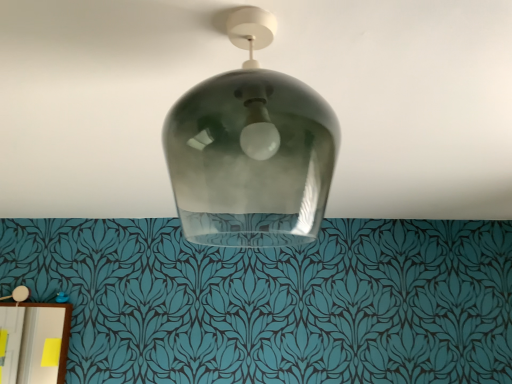
Question: Is matte white lampshade at lower left, the 1th lamp in the left-to-right sequence, beside smoke glass lampshade at center, the first lamp viewed from the front?

Choices:
 (A) no
 (B) yes

Answer: (A)

Question: Is matte white lampshade at lower left, the first lamp in the bottom-to-top sequence, smaller than smoke glass lampshade at center, the first lamp viewed from the front?

Choices:
 (A) no
 (B) yes

Answer: (B)

Question: From the image's perspective, is matte white lampshade at lower left, which is counted as the 2th lamp, starting from the front, under smoke glass lampshade at center, the first lamp viewed from the front?

Choices:
 (A) no
 (B) yes

Answer: (B)

Question: Is matte white lampshade at lower left, the 1th lamp in the left-to-right sequence, oriented towards smoke glass lampshade at center, marked as the second lamp in a left-to-right arrangement?

Choices:
 (A) yes
 (B) no

Answer: (B)

Question: Considering the relative positions of matte white lampshade at lower left, marked as the second lamp in a top-to-bottom arrangement, and smoke glass lampshade at center, placed as the 1th lamp when sorted from right to left, in the image provided, is matte white lampshade at lower left, marked as the second lamp in a top-to-bottom arrangement, to the left of smoke glass lampshade at center, placed as the 1th lamp when sorted from right to left, from the viewer's perspective?

Choices:
 (A) yes
 (B) no

Answer: (A)

Question: From the image's perspective, is matte white lampshade at lower left, which is counted as the 2th lamp, starting from the right, above or below smoke glass lampshade at center, which is counted as the second lamp, starting from the bottom?

Choices:
 (A) above
 (B) below

Answer: (B)

Question: Is matte white lampshade at lower left, the 1th lamp in the left-to-right sequence, inside the boundaries of smoke glass lampshade at center, acting as the first lamp starting from the top, or outside?

Choices:
 (A) inside
 (B) outside

Answer: (B)

Question: Considering the positions of matte white lampshade at lower left, marked as the second lamp in a top-to-bottom arrangement, and smoke glass lampshade at center, the first lamp viewed from the front, in the image, is matte white lampshade at lower left, marked as the second lamp in a top-to-bottom arrangement, bigger or smaller than smoke glass lampshade at center, the first lamp viewed from the front,?

Choices:
 (A) small
 (B) big

Answer: (A)

Question: Considering the positions of point click(29, 294) and point click(215, 195), is point click(29, 294) closer or farther from the camera than point click(215, 195)?

Choices:
 (A) farther
 (B) closer

Answer: (A)

Question: Is point (328, 148) closer or farther from the camera than point (10, 296)?

Choices:
 (A) closer
 (B) farther

Answer: (A)

Question: Which is correct: smoke glass lampshade at center, marked as the second lamp in a left-to-right arrangement, is inside matte white lampshade at lower left, which is counted as the 2th lamp, starting from the front, or outside of it?

Choices:
 (A) outside
 (B) inside

Answer: (A)

Question: Looking at the image, does smoke glass lampshade at center, which ranks as the 2th lamp in back-to-front order, seem bigger or smaller compared to matte white lampshade at lower left, which is counted as the 2th lamp, starting from the right?

Choices:
 (A) small
 (B) big

Answer: (B)

Question: From the image's perspective, is smoke glass lampshade at center, the first lamp viewed from the front, positioned above or below matte white lampshade at lower left, which is counted as the 2th lamp, starting from the front?

Choices:
 (A) above
 (B) below

Answer: (A)

Question: In the image, is transparent glass light fixture at center positioned in front of or behind smoke glass lampshade at center, marked as the second lamp in a left-to-right arrangement?

Choices:
 (A) front
 (B) behind

Answer: (B)

Question: Is transparent glass light fixture at center taller or shorter than smoke glass lampshade at center, marked as the second lamp in a left-to-right arrangement?

Choices:
 (A) tall
 (B) short

Answer: (B)